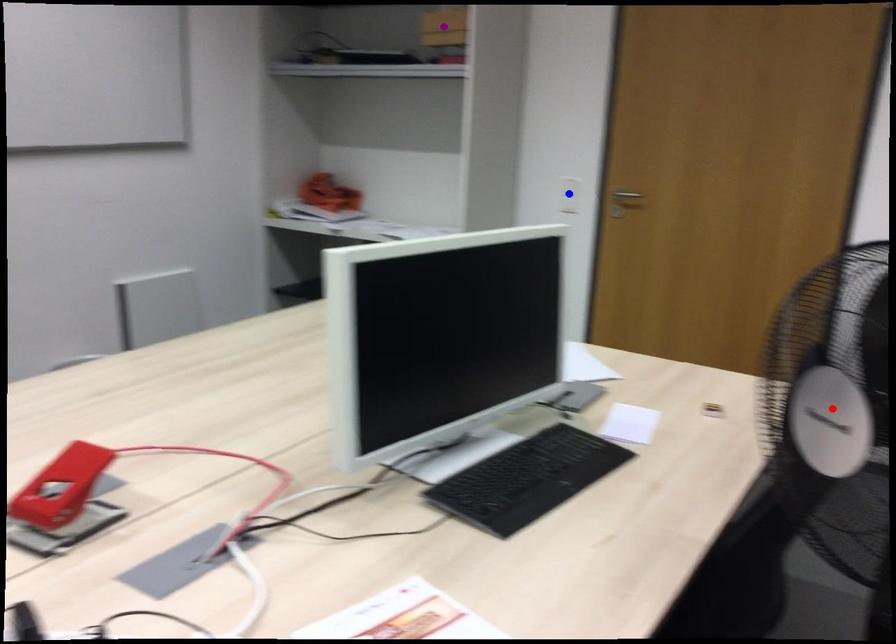
Consider the image. Order these from nearest to farthest:
purple point, red point, blue point

red point < purple point < blue point